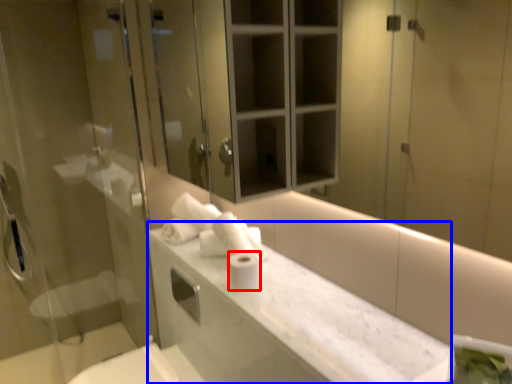
Question: Which point is further to the camera, toilet paper (highlighted by a red box) or counter top (highlighted by a blue box)?

Choices:
 (A) toilet paper
 (B) counter top

Answer: (A)